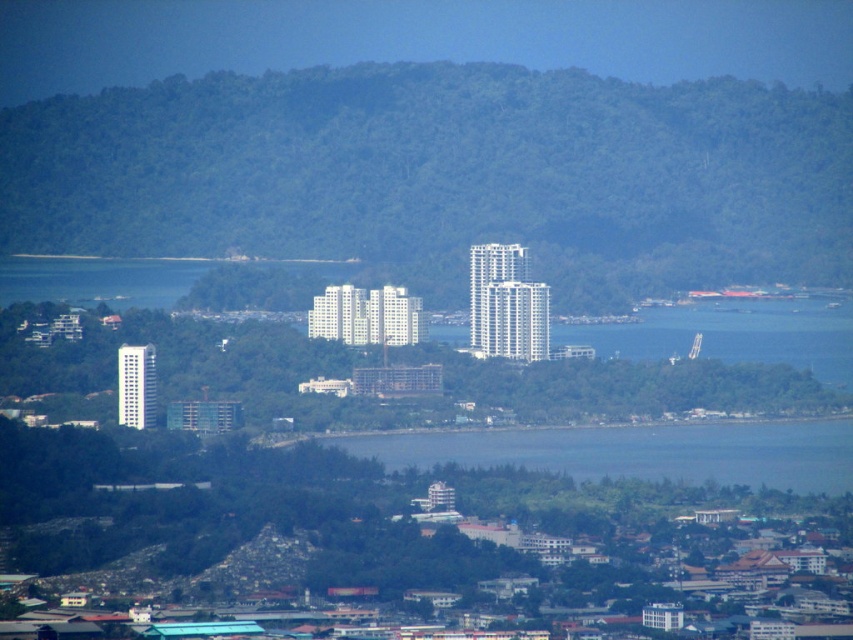
Question: Among these points, which one is nearest to the camera?

Choices:
 (A) (119, 209)
 (B) (619, 449)

Answer: (B)

Question: Which of the following is the closest to the observer?

Choices:
 (A) (822, 461)
 (B) (674, 120)

Answer: (B)

Question: Is green leafy mountain at center smaller than blue water at center?

Choices:
 (A) yes
 (B) no

Answer: (B)

Question: Is green leafy mountain at center thinner than blue water at center?

Choices:
 (A) no
 (B) yes

Answer: (A)

Question: Is green leafy mountain at center thinner than blue water at center?

Choices:
 (A) no
 (B) yes

Answer: (A)

Question: Which point is farther to the camera?

Choices:
 (A) green leafy mountain at center
 (B) blue water at center

Answer: (B)